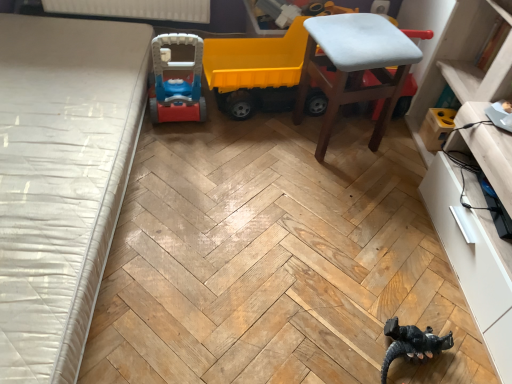
Question: Is white glossy dresser at lower right next to yellow plastic toy truck at center?

Choices:
 (A) no
 (B) yes

Answer: (A)

Question: Is white glossy dresser at lower right shorter than yellow plastic toy truck at center?

Choices:
 (A) yes
 (B) no

Answer: (B)

Question: Is white glossy dresser at lower right positioned beyond the bounds of yellow plastic toy truck at center?

Choices:
 (A) yes
 (B) no

Answer: (A)

Question: Is white glossy dresser at lower right facing towards yellow plastic toy truck at center?

Choices:
 (A) no
 (B) yes

Answer: (A)

Question: Is yellow plastic toy truck at center completely or partially inside white glossy dresser at lower right?

Choices:
 (A) no
 (B) yes

Answer: (A)

Question: Does point (456, 235) appear closer or farther from the camera than point (286, 56)?

Choices:
 (A) farther
 (B) closer

Answer: (B)

Question: Looking at their shapes, would you say white glossy dresser at lower right is wider or thinner than yellow plastic toy truck at center?

Choices:
 (A) thin
 (B) wide

Answer: (B)

Question: From a real-world perspective, is white glossy dresser at lower right physically located above or below yellow plastic toy truck at center?

Choices:
 (A) above
 (B) below

Answer: (A)

Question: Relative to yellow plastic toy truck at center, is white glossy dresser at lower right in front or behind?

Choices:
 (A) front
 (B) behind

Answer: (A)

Question: Choose the correct answer: Is white textured mattress at left inside yellow plastic toy truck at center or outside it?

Choices:
 (A) outside
 (B) inside

Answer: (A)

Question: From a real-world perspective, relative to yellow plastic toy truck at center, is white textured mattress at left vertically above or below?

Choices:
 (A) above
 (B) below

Answer: (B)

Question: Is point (109, 122) closer or farther from the camera than point (232, 39)?

Choices:
 (A) closer
 (B) farther

Answer: (A)

Question: Visually, is white textured mattress at left positioned to the left or to the right of yellow plastic toy truck at center?

Choices:
 (A) right
 (B) left

Answer: (B)

Question: Is point (406, 342) positioned closer to the camera than point (399, 66)?

Choices:
 (A) farther
 (B) closer

Answer: (B)

Question: Do you think black matte toy dinosaur at lower right is within light blue fabric stool at upper right, or outside of it?

Choices:
 (A) outside
 (B) inside

Answer: (A)